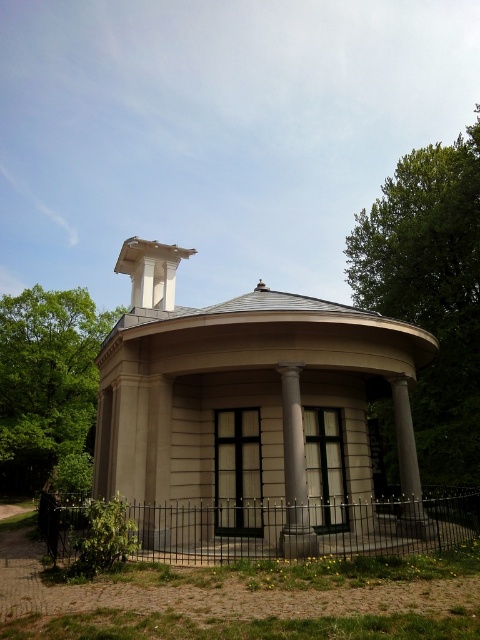
Question: Considering the real-world distances, which object is closest to the green leafy tree at upper left?

Choices:
 (A) beige stone gazebo at center
 (B) white marble chimney at upper center
 (C) green leafy tree at upper right

Answer: (C)

Question: Based on their relative distances, which object is nearer to the green leafy tree at upper left?

Choices:
 (A) beige stone gazebo at center
 (B) white marble chimney at upper center
 (C) white smooth column at center

Answer: (B)

Question: Does beige stone gazebo at center have a greater width compared to green leafy tree at upper left?

Choices:
 (A) yes
 (B) no

Answer: (A)

Question: Is the position of green leafy tree at upper right more distant than that of green leafy tree at upper left?

Choices:
 (A) yes
 (B) no

Answer: (B)

Question: Is green leafy tree at upper right closer to camera compared to white smooth column at center?

Choices:
 (A) yes
 (B) no

Answer: (B)

Question: Which of the following is the farthest from the observer?

Choices:
 (A) green leafy tree at upper right
 (B) green leafy tree at upper left

Answer: (B)